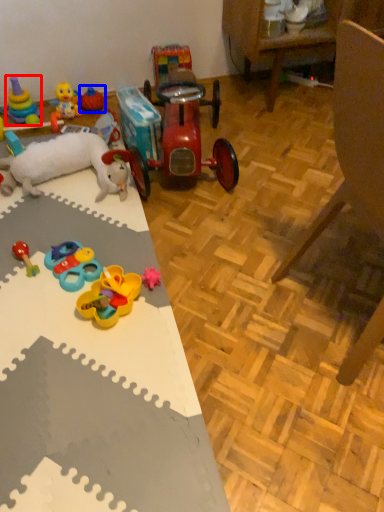
Question: Among these objects, which one is nearest to the camera, toy (highlighted by a red box) or toy (highlighted by a blue box)?

Choices:
 (A) toy
 (B) toy

Answer: (A)